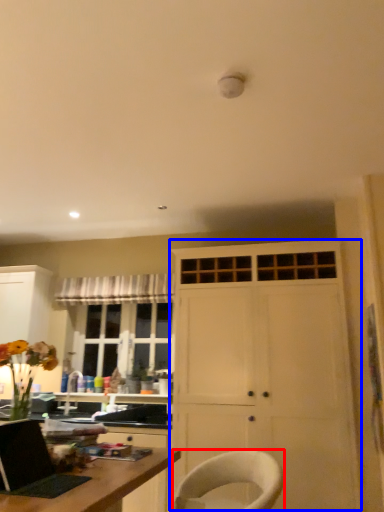
Question: Which object is further to the camera taking this photo, chair (highlighted by a red box) or cabinetry (highlighted by a blue box)?

Choices:
 (A) chair
 (B) cabinetry

Answer: (B)